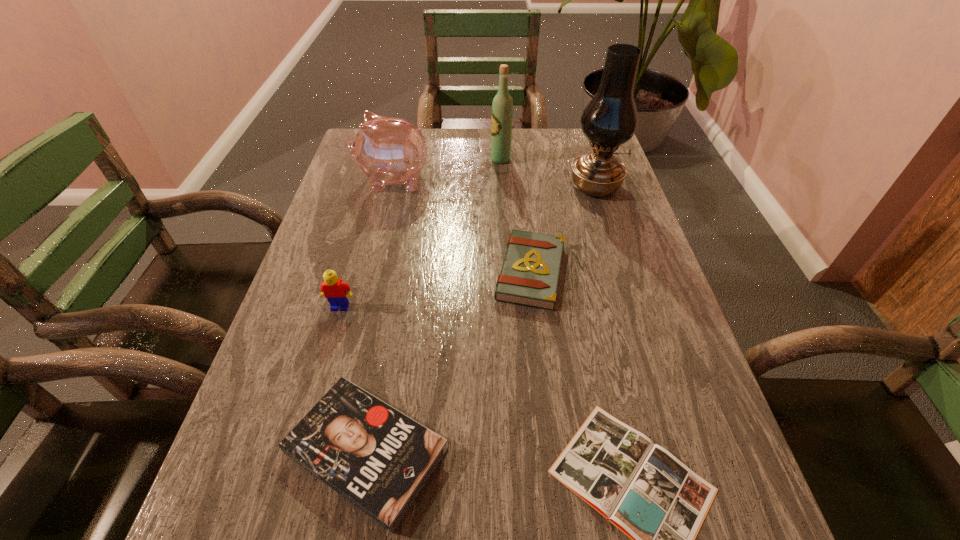
This screenshot has width=960, height=540. I want to click on free space located 0.360m on the front-facing side of the fourth shortest object, so click(291, 477).

Find the location of a particular element. free space located on the left of the farthest book is located at coordinates pos(328,272).

The height and width of the screenshot is (540, 960). In order to click on free space located 0.310m on the right of the leftmost book in this screenshot , I will do `click(626, 451)`.

Identify the location of wine bottle that is at the far edge. (502, 106).

The image size is (960, 540). What are the coordinates of `piggy bank positioned at the far edge` in the screenshot? It's located at (388, 150).

Where is `object at the near edge`? This screenshot has width=960, height=540. object at the near edge is located at coordinates (379, 459).

Where is `piggy bank positioned at the left edge`? piggy bank positioned at the left edge is located at coordinates (388, 150).

This screenshot has width=960, height=540. I want to click on Lego that is at the left edge, so [336, 291].

This screenshot has width=960, height=540. In order to click on book present at the left edge in this screenshot , I will do `click(379, 459)`.

Where is `object positioned at the right edge`? The width and height of the screenshot is (960, 540). object positioned at the right edge is located at coordinates (610, 119).